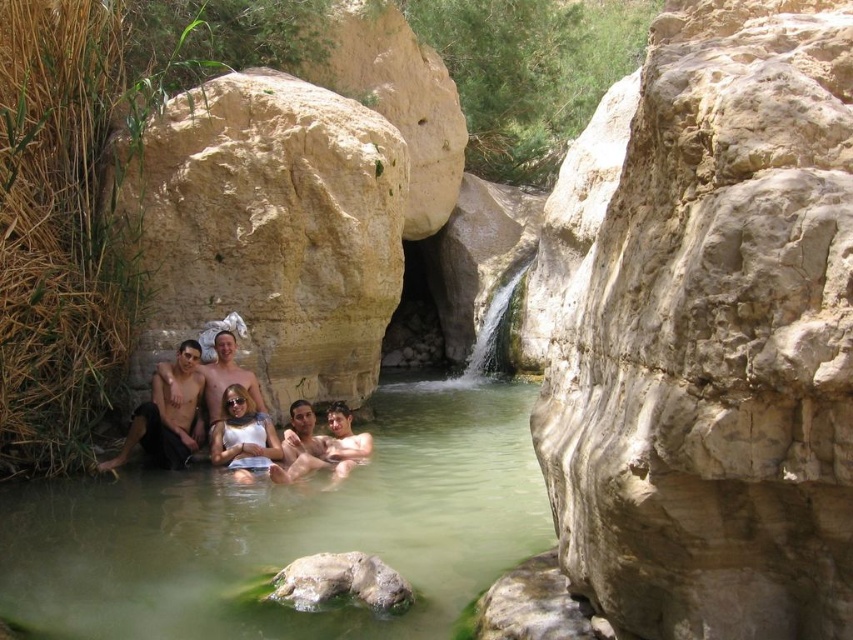
You are standing at the edge of the pool and want to reach both the point at coordinates point (462, 419) and point (154, 428). Which point should you reach first to get closer to the viewer?

You should reach point (462, 419) first because it is closer to the viewer compared to point (154, 428).

You are standing at the edge of the pool and want to reach both the point at coordinates point (178, 365) and point (297, 452). Which point should you reach first if you want to touch both points in the order closest to farthest from your current position?

You should reach point (178, 365) first because it is closer to you than point (297, 452), which is further away.